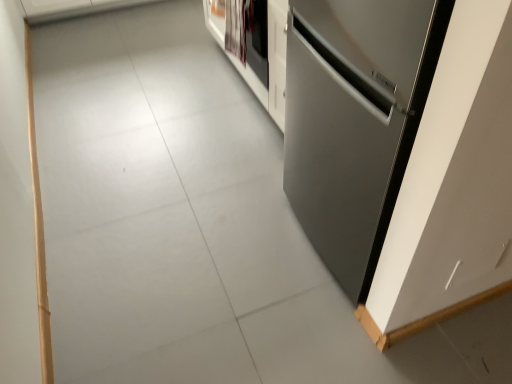
Describe the element at coordinates (237, 27) in the screenshot. I see `velvet-like fabric laundry at upper center` at that location.

In order to click on velvet-like fabric laundry at upper center in this screenshot , I will do `click(237, 27)`.

The image size is (512, 384). Find the location of `velvet-like fabric laundry at upper center`. velvet-like fabric laundry at upper center is located at coordinates (237, 27).